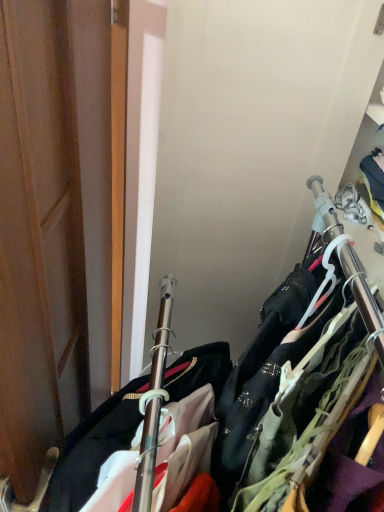
Question: From a real-world perspective, is wooden door at left physically located above or below metallic hangers at center?

Choices:
 (A) above
 (B) below

Answer: (A)

Question: Is point (82, 203) positioned closer to the camera than point (339, 291)?

Choices:
 (A) farther
 (B) closer

Answer: (A)

Question: From the image's perspective, is wooden door at left above or below metallic hangers at center?

Choices:
 (A) below
 (B) above

Answer: (B)

Question: From a real-world perspective, relative to wooden door at left, is metallic hangers at center vertically above or below?

Choices:
 (A) below
 (B) above

Answer: (A)

Question: From the image's perspective, is metallic hangers at center positioned above or below wooden door at left?

Choices:
 (A) above
 (B) below

Answer: (B)

Question: From their relative heights in the image, would you say metallic hangers at center is taller or shorter than wooden door at left?

Choices:
 (A) tall
 (B) short

Answer: (A)

Question: Is metallic hangers at center in front of or behind wooden door at left in the image?

Choices:
 (A) behind
 (B) front

Answer: (A)